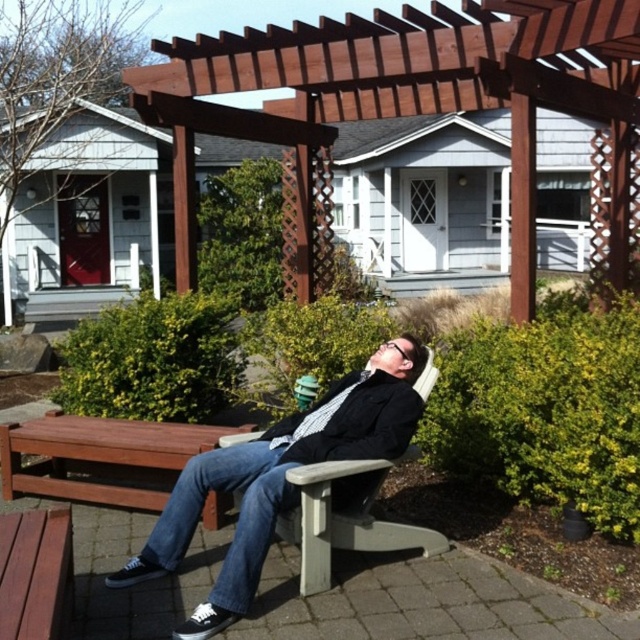
You are a photographer positioned to the left of the scene. You want to capture a clear photo of the matte black jacket at center without the brown wood pergola at upper center blocking it. Is this possible based on their positions?

The matte black jacket at center is behind the brown wood pergola at upper center, so it would be blocked from view. To capture the jacket clearly, you would need to adjust your position or angle to avoid the pergola.

You are a photographer setting up a shot of the brown wood pergola at upper center and the matte black jacket at center. Which object should you zoom in on to capture more detail without changing the camera position, and why?

You should zoom in on the brown wood pergola at upper center because it is smaller in size compared to the matte black jacket at center, so it needs more magnification to fill the frame.